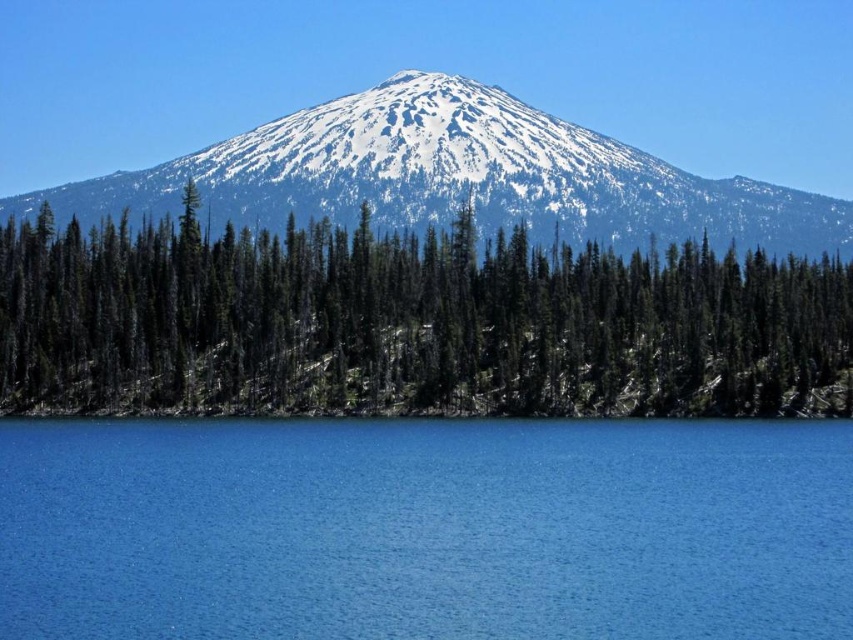
Question: Is green textured trees at center closer to the viewer compared to snowy white mountain at center?

Choices:
 (A) yes
 (B) no

Answer: (A)

Question: Which object is closer to the camera taking this photo?

Choices:
 (A) blue liquid at lower center
 (B) green textured trees at center

Answer: (A)

Question: Which object is farther from the camera taking this photo?

Choices:
 (A) blue liquid at lower center
 (B) snowy white mountain at center

Answer: (B)

Question: Which point is closer to the camera?

Choices:
 (A) green textured trees at center
 (B) blue liquid at lower center

Answer: (B)

Question: Is green textured trees at center to the right of snowy white mountain at center from the viewer's perspective?

Choices:
 (A) no
 (B) yes

Answer: (B)

Question: Can you confirm if blue liquid at lower center is positioned below snowy white mountain at center?

Choices:
 (A) no
 (B) yes

Answer: (B)